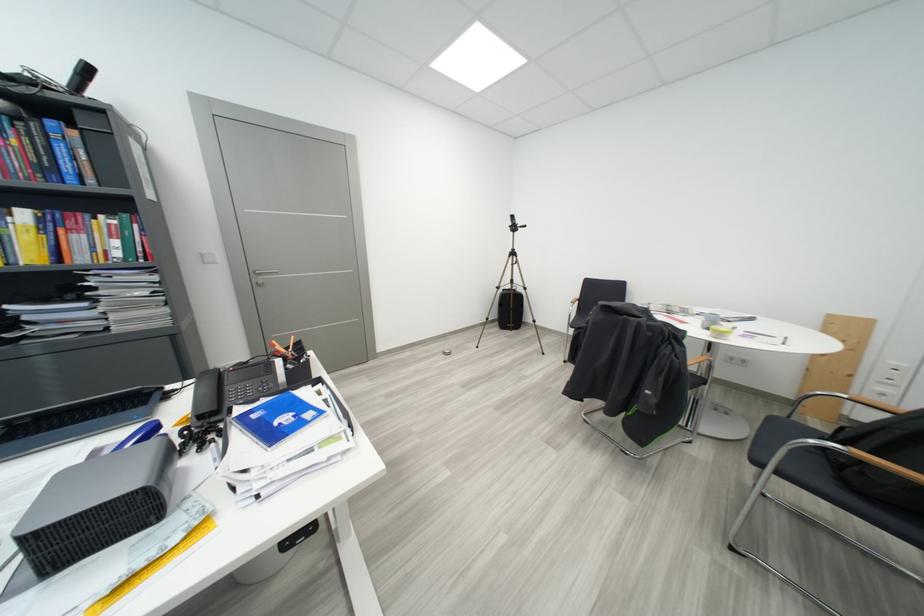
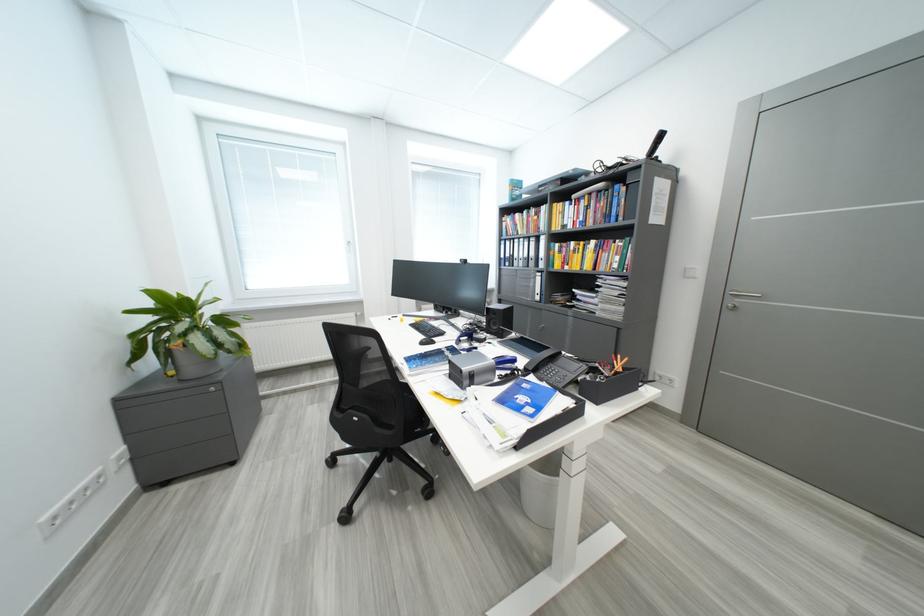
The point at (209, 419) is marked in the first image. Where is the corresponding point in the second image?

(535, 371)